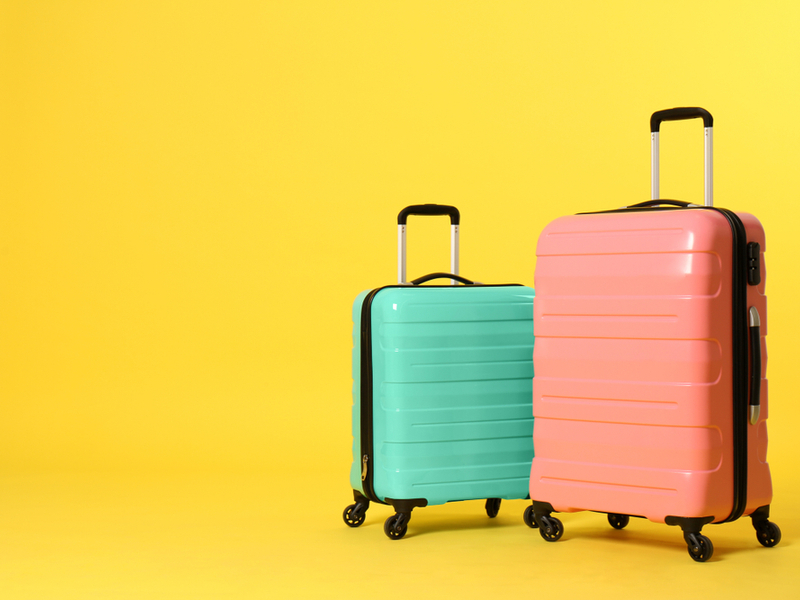
Find the location of `handle`. handle is located at coordinates (422, 198), (442, 270), (646, 204), (676, 114), (756, 346).